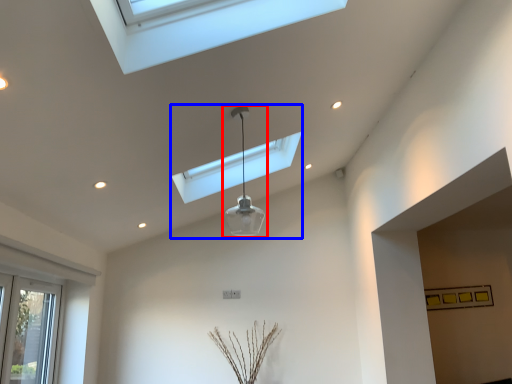
Question: Which point is further to the camera, lamp (highlighted by a red box) or lamp (highlighted by a blue box)?

Choices:
 (A) lamp
 (B) lamp

Answer: (B)